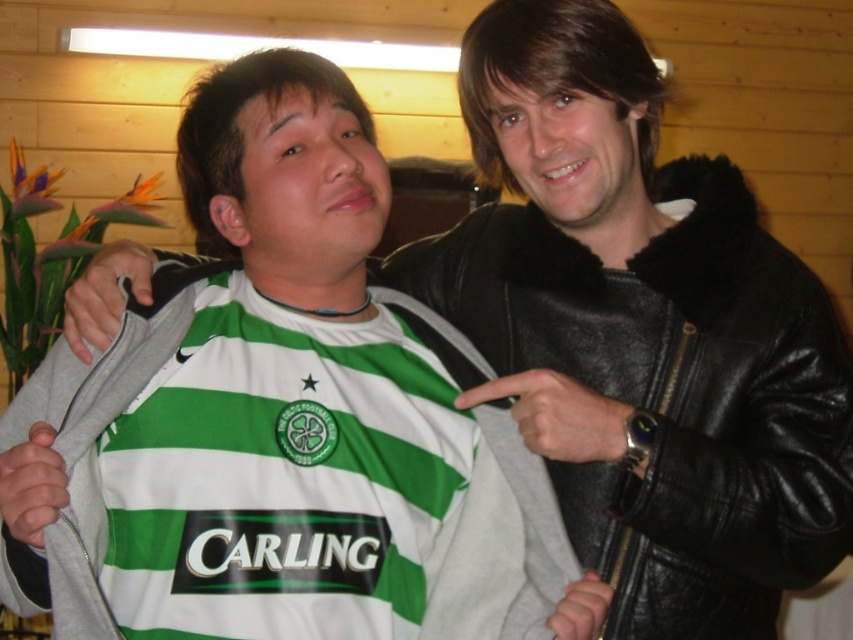
Question: Is black leather jacket at right in front of gray fleece jacket at center?

Choices:
 (A) no
 (B) yes

Answer: (A)

Question: Which point appears closest to the camera in this image?

Choices:
 (A) (764, 518)
 (B) (529, 596)

Answer: (B)

Question: Can you confirm if black leather jacket at right is smaller than gray fleece jacket at center?

Choices:
 (A) yes
 (B) no

Answer: (B)

Question: Where is black leather jacket at right located in relation to gray fleece jacket at center in the image?

Choices:
 (A) left
 (B) right

Answer: (B)

Question: Which object is farther from the camera taking this photo?

Choices:
 (A) gray fleece jacket at center
 (B) black leather jacket at right

Answer: (B)